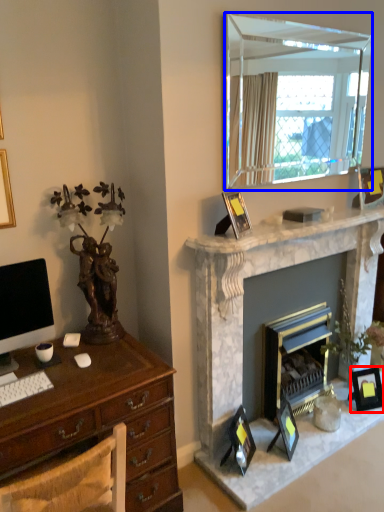
Question: Which point is further to the camera, picture frame (highlighted by a red box) or mirror (highlighted by a blue box)?

Choices:
 (A) picture frame
 (B) mirror

Answer: (A)